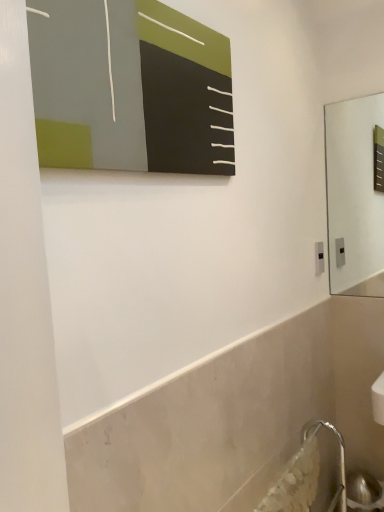
Measure the distance between point (74,103) and camera.

Point (74,103) and camera are 32.87 inches apart.

The height and width of the screenshot is (512, 384). What are the coordinates of `matte black board at upper center` in the screenshot? It's located at (130, 88).

What do you see at coordinates (130, 88) in the screenshot? The width and height of the screenshot is (384, 512). I see `matte black board at upper center` at bounding box center [130, 88].

Where is `matte black board at upper center`? matte black board at upper center is located at coordinates (130, 88).